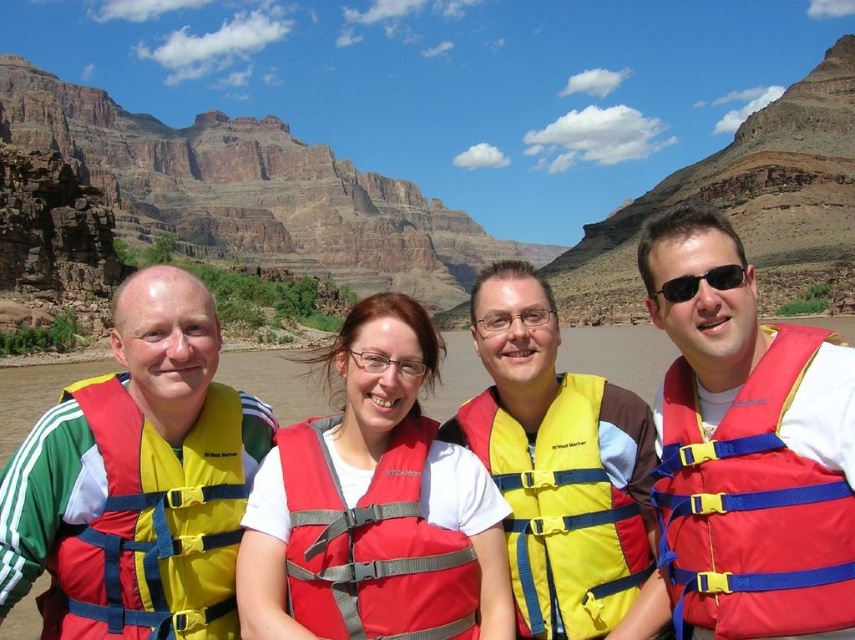
From the picture: You are a photographer at the Grand Canyon. You notice two life jackets in the scene, the red fabric life jacket at right and the matte red life jacket at center. Which one is positioned higher in the image?

The red fabric life jacket at right is positioned higher in the image because it is above the matte red life jacket at center.

You are a photographer standing at the edge of the Grand Canyon. You want to take a photo of the two red life jackets, the red fabric life jacket at right and the matte red life jacket at center, so that both are in focus. The camera you are using has a depth of field that can cover 10 meters. Can you capture both jackets in focus without adjusting your camera settings?

The red fabric life jacket at right and the matte red life jacket at center are 11.60 meters apart from each other. Since the camera can only cover 10 meters in depth of field, you cannot capture both jackets in focus without adjusting your camera settings.

You are a photographer trying to capture a photo of the two life jackets. The matte yellow life jacket at left and the yellow fabric life jacket at center. Which one is shorter in height?

The matte yellow life jacket at left is not as tall as the yellow fabric life jacket at center, so the matte yellow life jacket at left is shorter in height.